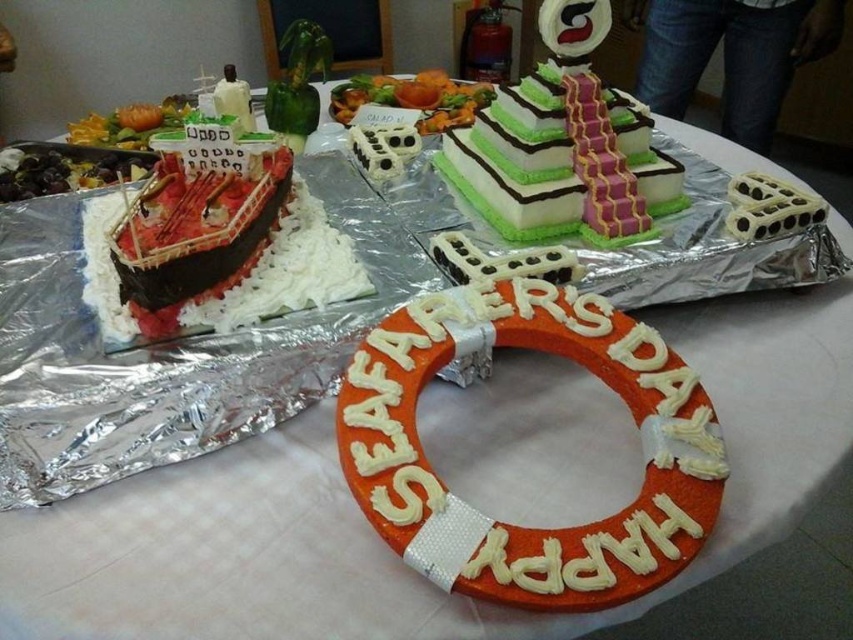
Question: Can you confirm if green frosted cake at center is wider than green leafy salad at center?

Choices:
 (A) yes
 (B) no

Answer: (B)

Question: Does orange fondant life belt at center appear over green frosted cake at center?

Choices:
 (A) no
 (B) yes

Answer: (A)

Question: Which is nearer to the green frosted cake at center?

Choices:
 (A) chocolate fondant boat at left
 (B) orange fondant life belt at center
 (C) green leafy salad at center

Answer: (B)

Question: Among these objects, which one is nearest to the camera?

Choices:
 (A) orange fondant life belt at center
 (B) chocolate fondant boat at left
 (C) green leafy salad at center
 (D) green frosted cake at center

Answer: (A)

Question: Which of the following is the closest to the observer?

Choices:
 (A) chocolate fondant boat at left
 (B) green frosted cake at center

Answer: (A)

Question: Can you confirm if chocolate fondant boat at left is positioned above green leafy salad at center?

Choices:
 (A) no
 (B) yes

Answer: (A)